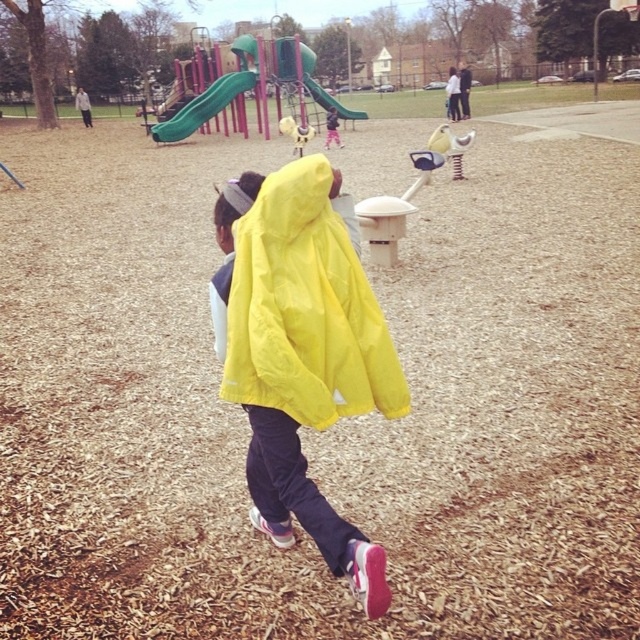
Which is more to the left, yellow matte jacket at center or green rubber slide at upper center?

green rubber slide at upper center is more to the left.

Can you confirm if yellow matte jacket at center is shorter than green rubber slide at upper center?

Incorrect, yellow matte jacket at center's height does not fall short of green rubber slide at upper center's.

Between point (285, 397) and point (326, 109), which one is positioned in front?

Point (285, 397) is in front.

Image resolution: width=640 pixels, height=640 pixels. I want to click on yellow matte jacket at center, so click(x=307, y=307).

Which is more to the left, yellow matte jacket at center or green plastic slide at upper center?

green plastic slide at upper center is more to the left.

Between yellow matte jacket at center and green plastic slide at upper center, which one is positioned lower?

yellow matte jacket at center

The height and width of the screenshot is (640, 640). Find the location of `yellow matte jacket at center`. yellow matte jacket at center is located at coordinates (307, 307).

This screenshot has height=640, width=640. I want to click on yellow matte jacket at center, so click(x=307, y=307).

Does green plastic slide at upper center appear over green rubber slide at upper center?

No.

Between green plastic slide at upper center and green rubber slide at upper center, which one appears on the right side from the viewer's perspective?

green rubber slide at upper center

Locate an element on the screen. The image size is (640, 640). green plastic slide at upper center is located at coordinates (204, 106).